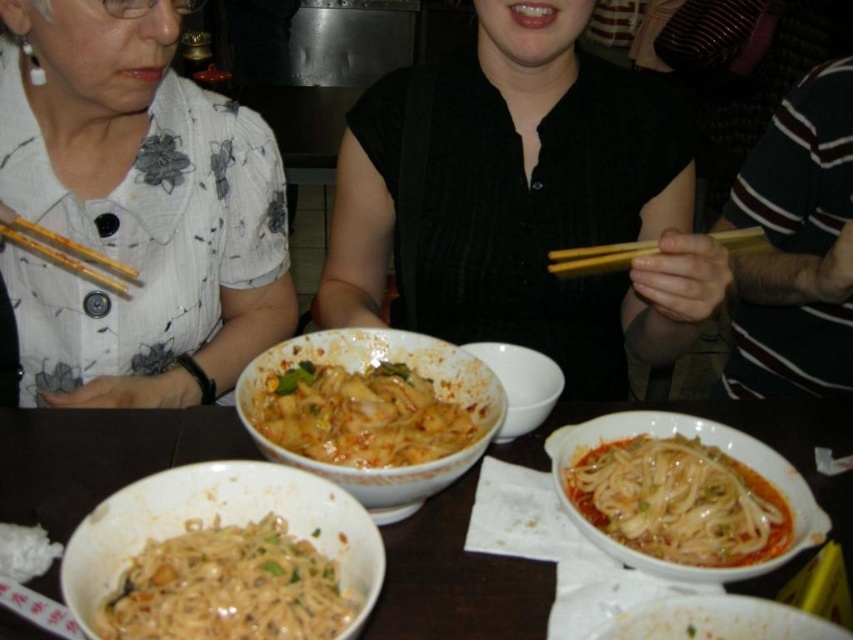
Is point (605, 531) closer to camera compared to point (0, 228)?

Yes, it is.

Is slightly glossy white noodles at center positioned in front of wooden chopsticks at left?

Yes, it is.

Describe the element at coordinates (677, 500) in the screenshot. The image size is (853, 640). I see `slightly glossy white noodles at center` at that location.

Where is `slightly glossy white noodles at center`? Image resolution: width=853 pixels, height=640 pixels. slightly glossy white noodles at center is located at coordinates (677, 500).

Which is above, matte ceramic bowl at center or yellow wood chopsticks at center?

yellow wood chopsticks at center

Can you confirm if matte ceramic bowl at center is positioned above yellow wood chopsticks at center?

No, matte ceramic bowl at center is not above yellow wood chopsticks at center.

Which is in front, point (560, 372) or point (656, 246)?

Point (656, 246) is more forward.

This screenshot has width=853, height=640. Find the location of `matte ceramic bowl at center`. matte ceramic bowl at center is located at coordinates 520,385.

Which is more to the right, white glossy bowl at lower left or spicy red noodles at center?

spicy red noodles at center is more to the right.

Does white glossy bowl at lower left have a greater height compared to spicy red noodles at center?

Yes.

Is point (329, 545) closer to viewer compared to point (289, 413)?

That is True.

The image size is (853, 640). I want to click on white glossy bowl at lower left, so click(x=221, y=524).